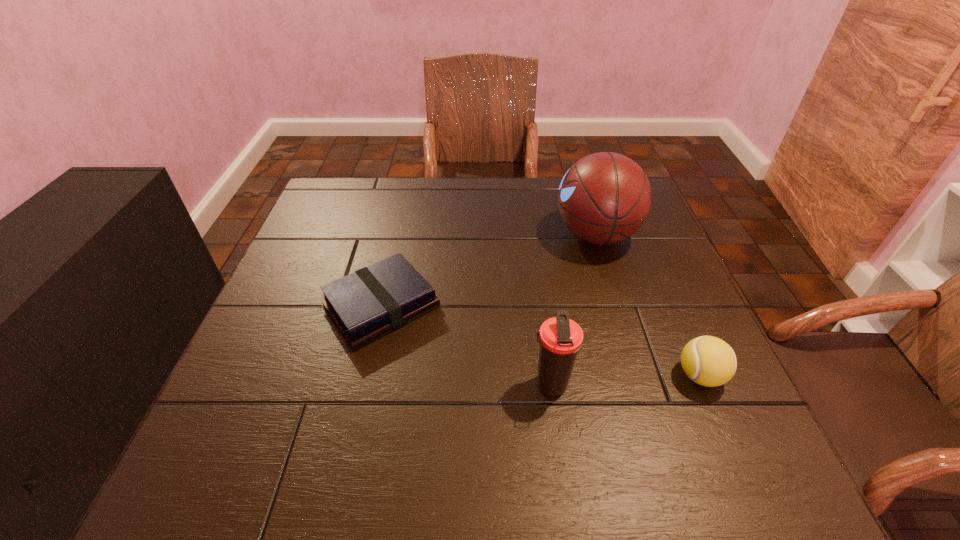
The image size is (960, 540). In the image, there is a desktop. Identify the location of vacant space at the near left corner. (264, 457).

Locate an element on the screen. free point between the third nearest object and the third shortest object is located at coordinates (466, 346).

This screenshot has height=540, width=960. I want to click on empty space between the tallest object and the third nearest object, so [489, 271].

You are a GUI agent. You are given a task and a screenshot of the screen. Output one action in this format:
    pyautogui.click(x=<x>, y=<y>)
    Task: Click on the free space between the shortest object and the tallest object
    This screenshot has width=960, height=540.
    Given the screenshot: What is the action you would take?
    pyautogui.click(x=489, y=271)

You are a GUI agent. You are given a task and a screenshot of the screen. Output one action in this format:
    pyautogui.click(x=<x>, y=<y>)
    Task: Click on the free area in between the tennis ball and the second tallest object
    
    Given the screenshot: What is the action you would take?
    pyautogui.click(x=625, y=381)

Where is `free spot between the shortest object and the farthest object`? This screenshot has height=540, width=960. free spot between the shortest object and the farthest object is located at coordinates (489, 271).

You are a GUI agent. You are given a task and a screenshot of the screen. Output one action in this format:
    pyautogui.click(x=<x>, y=<y>)
    Task: Click on the free space that is in between the leftmost object and the thermos bottle
    The image size is (960, 540).
    Given the screenshot: What is the action you would take?
    pyautogui.click(x=466, y=346)

Where is `free spot between the second object from left to right and the tennis ball`? free spot between the second object from left to right and the tennis ball is located at coordinates click(625, 381).

In order to click on unoccupied position between the tallest object and the second object from left to right in this screenshot , I will do `click(573, 310)`.

I want to click on vacant point located between the farthest object and the tennis ball, so tap(648, 305).